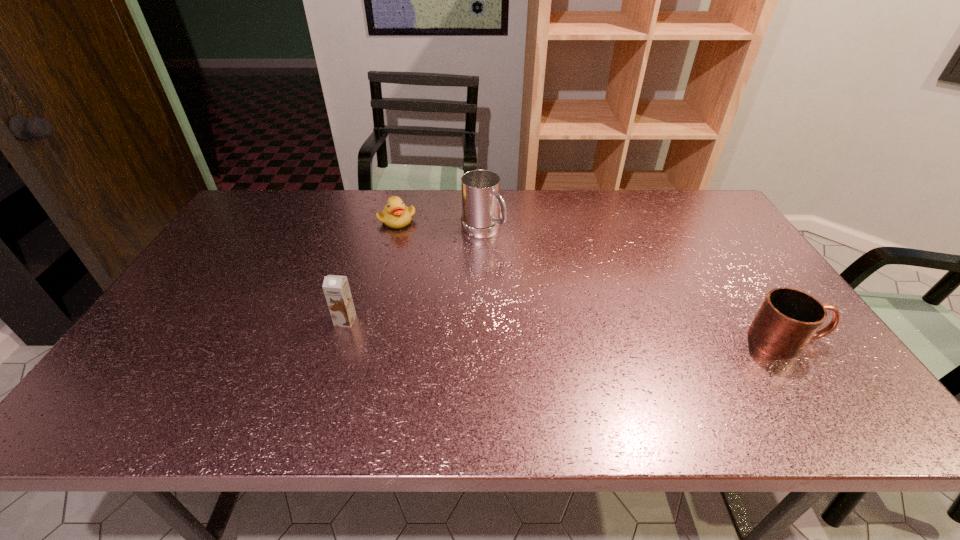
Where is `free space on the desktop that is between the chocolate milk and the second shortest object and is positioned on the side of the taller mug with the handle`? free space on the desktop that is between the chocolate milk and the second shortest object and is positioned on the side of the taller mug with the handle is located at coordinates (624, 333).

Locate an element on the screen. Image resolution: width=960 pixels, height=540 pixels. vacant space on the desktop that is between the second tallest object and the rightmost object and is positioned on the front-facing side of the shortest object is located at coordinates (557, 330).